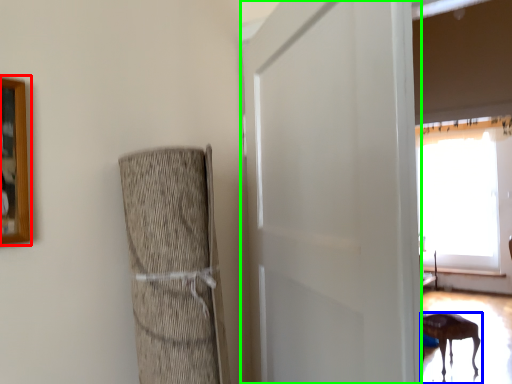
Question: Considering the real-world distances, which object is closest to picture frame (highlighted by a red box)? furniture (highlighted by a blue box) or screen door (highlighted by a green box).

Choices:
 (A) furniture
 (B) screen door

Answer: (B)